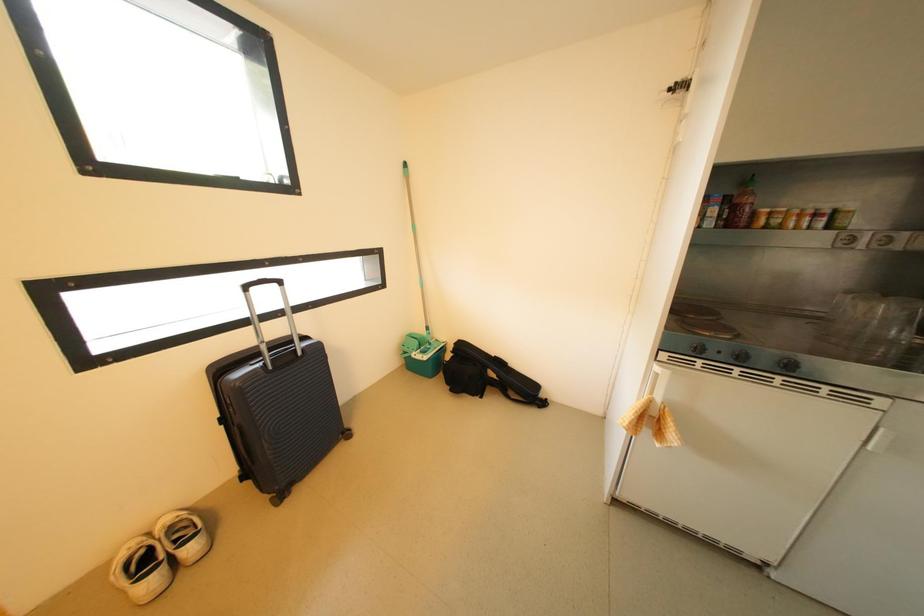
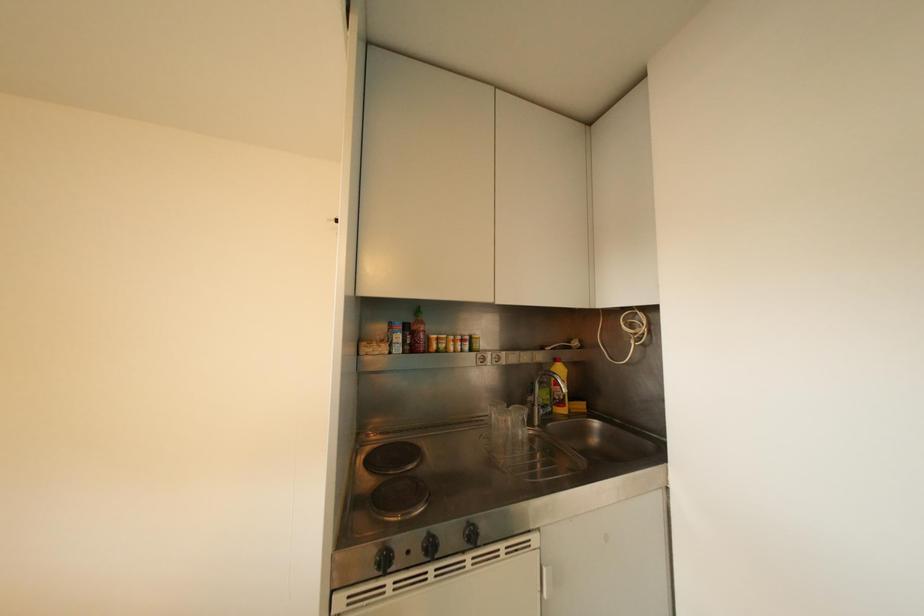
The first image is from the beginning of the video and the second image is from the end. How did the camera likely rotate when shooting the video?

The rotation direction of the camera is right-up.